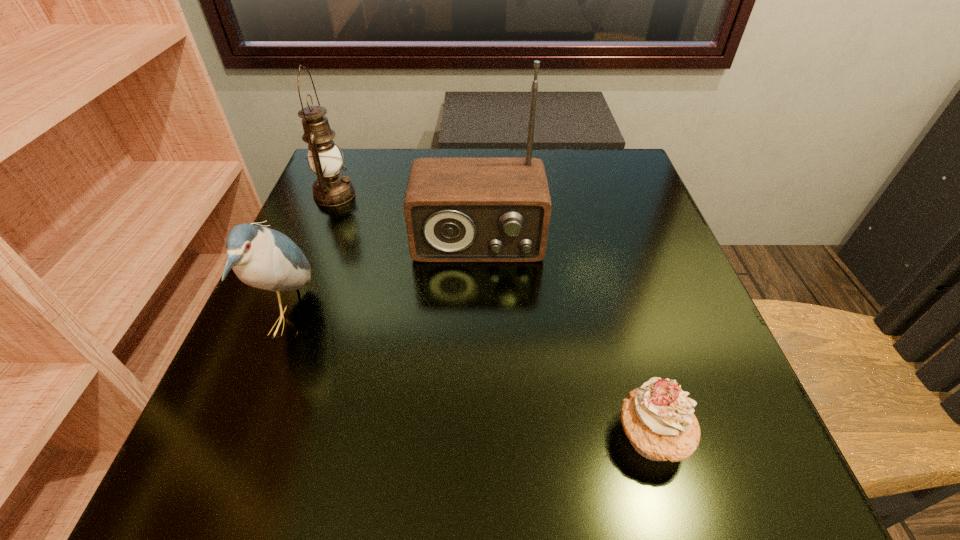
Where is `vacant region at the left edge of the desktop`? The width and height of the screenshot is (960, 540). vacant region at the left edge of the desktop is located at coordinates (366, 227).

This screenshot has height=540, width=960. What are the coordinates of `vacant space at the right edge` in the screenshot? It's located at (661, 246).

In the image, there is a desktop. In order to click on vacant space at the far left corner in this screenshot , I will do `click(367, 169)`.

Where is `free region at the far right corner of the desktop`? The image size is (960, 540). free region at the far right corner of the desktop is located at coordinates (612, 191).

Where is `vacant area that lies between the farthest object and the cupcake`? This screenshot has width=960, height=540. vacant area that lies between the farthest object and the cupcake is located at coordinates point(493,316).

You are a GUI agent. You are given a task and a screenshot of the screen. Output one action in this format:
    pyautogui.click(x=<x>, y=<y>)
    Task: Click on the free space between the third nearest object and the bird
    The image size is (960, 540).
    Given the screenshot: What is the action you would take?
    pyautogui.click(x=384, y=281)

Where is `vacant area between the second farthest object and the bird`? Image resolution: width=960 pixels, height=540 pixels. vacant area between the second farthest object and the bird is located at coordinates (384, 281).

Find the location of a particular element. This screenshot has width=960, height=540. vacant point located between the nearest object and the oil lamp is located at coordinates (493, 316).

Find the location of a particular element. The image size is (960, 540). free point between the farthest object and the second shortest object is located at coordinates (313, 258).

Where is `free space between the nearest object and the second farthest object`? free space between the nearest object and the second farthest object is located at coordinates (564, 339).